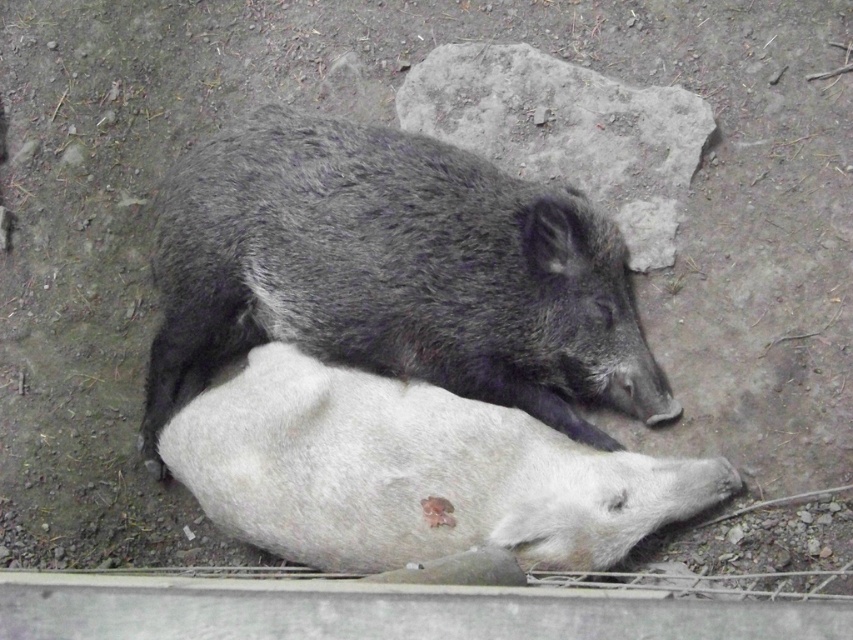
Can you confirm if gray fur pig at center is positioned to the right of gray rough rock at upper center?

No, gray fur pig at center is not to the right of gray rough rock at upper center.

Between gray fur pig at center and gray rough rock at upper center, which one appears on the left side from the viewer's perspective?

Positioned to the left is gray fur pig at center.

This screenshot has width=853, height=640. I want to click on gray fur pig at center, so click(x=393, y=273).

Based on the photo, which of these two, gray fur pig at center or white matte pig at center, stands taller?

With more height is gray fur pig at center.

Based on the photo, is gray fur pig at center above white matte pig at center?

Correct, gray fur pig at center is located above white matte pig at center.

Identify the location of gray fur pig at center. pos(393,273).

Does white matte pig at center appear on the left side of gray rough rock at upper center?

Correct, you'll find white matte pig at center to the left of gray rough rock at upper center.

Can you confirm if white matte pig at center is smaller than gray rough rock at upper center?

No.

Who is more distant from viewer, (345, 492) or (582, 68)?

The point (582, 68) is more distant.

This screenshot has width=853, height=640. I want to click on white matte pig at center, so click(x=412, y=472).